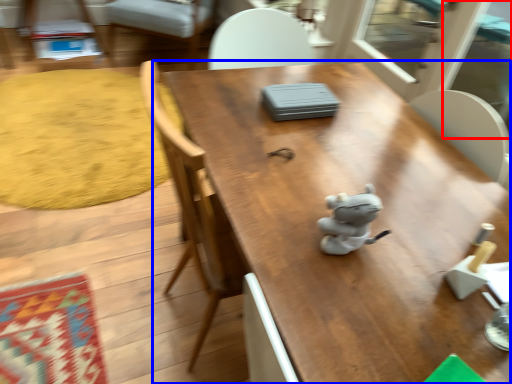
Question: Which of the following is the closest to the observer, screen door (highlighted by a red box) or table (highlighted by a blue box)?

Choices:
 (A) screen door
 (B) table

Answer: (B)